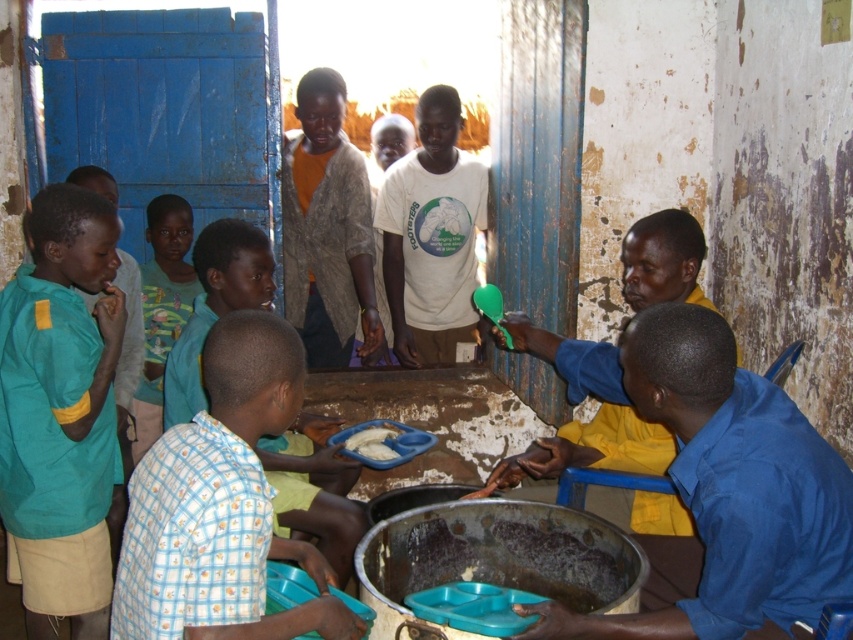
Is point (393, 196) more distant than point (282, 513)?

That is True.

Between white matte t-shirt at center and light blue checkered shirt at center, which one has less height?

light blue checkered shirt at center is shorter.

Image resolution: width=853 pixels, height=640 pixels. Find the location of `white matte t-shirt at center`. white matte t-shirt at center is located at coordinates (431, 236).

Between blue shirt at right and green cotton shirt at center, which one appears on the right side from the viewer's perspective?

blue shirt at right

Locate an element on the screen. blue shirt at right is located at coordinates (724, 496).

Is point (706, 394) farther from viewer compared to point (169, 236)?

No, it is not.

What are the coordinates of `blue shirt at right` in the screenshot? It's located at (724, 496).

Is green fabric shirt at left in front of white matte food at center?

Yes, green fabric shirt at left is closer to the viewer.

Consider the image. Can you confirm if green fabric shirt at left is thinner than white matte food at center?

No, green fabric shirt at left is not thinner than white matte food at center.

The image size is (853, 640). In order to click on green fabric shirt at left in this screenshot , I will do `click(61, 412)`.